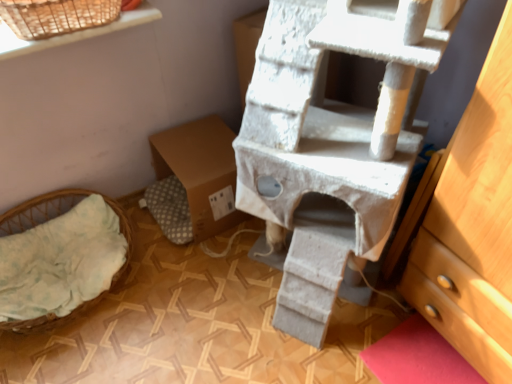
Question: Considering the relative positions of light green fabric basket at lower left and brown cardboard box at center in the image provided, is light green fabric basket at lower left to the left of brown cardboard box at center from the viewer's perspective?

Choices:
 (A) no
 (B) yes

Answer: (B)

Question: Is light green fabric basket at lower left facing away from brown cardboard box at center?

Choices:
 (A) no
 (B) yes

Answer: (A)

Question: Is light green fabric basket at lower left not close to brown cardboard box at center?

Choices:
 (A) no
 (B) yes

Answer: (A)

Question: Can you confirm if light green fabric basket at lower left is smaller than brown cardboard box at center?

Choices:
 (A) no
 (B) yes

Answer: (B)

Question: Is light green fabric basket at lower left shorter than brown cardboard box at center?

Choices:
 (A) yes
 (B) no

Answer: (A)

Question: Visually, is white textured cat tree at center positioned to the left or to the right of brown cardboard box at center?

Choices:
 (A) right
 (B) left

Answer: (A)

Question: In terms of width, does white textured cat tree at center look wider or thinner when compared to brown cardboard box at center?

Choices:
 (A) thin
 (B) wide

Answer: (B)

Question: From their relative heights in the image, would you say white textured cat tree at center is taller or shorter than brown cardboard box at center?

Choices:
 (A) tall
 (B) short

Answer: (A)

Question: Based on their sizes in the image, would you say white textured cat tree at center is bigger or smaller than brown cardboard box at center?

Choices:
 (A) big
 (B) small

Answer: (A)

Question: From the image's perspective, relative to light green fabric basket at lower left, is brown cardboard box at center above or below?

Choices:
 (A) above
 (B) below

Answer: (A)

Question: From a real-world perspective, is brown cardboard box at center positioned above or below light green fabric basket at lower left?

Choices:
 (A) below
 (B) above

Answer: (B)

Question: Is brown cardboard box at center in front of or behind light green fabric basket at lower left in the image?

Choices:
 (A) behind
 (B) front

Answer: (A)

Question: Is brown cardboard box at center taller or shorter than light green fabric basket at lower left?

Choices:
 (A) tall
 (B) short

Answer: (A)

Question: Is light green fabric basket at lower left spatially inside white textured cat tree at center, or outside of it?

Choices:
 (A) outside
 (B) inside

Answer: (A)

Question: From the image's perspective, is light green fabric basket at lower left above or below white textured cat tree at center?

Choices:
 (A) below
 (B) above

Answer: (A)